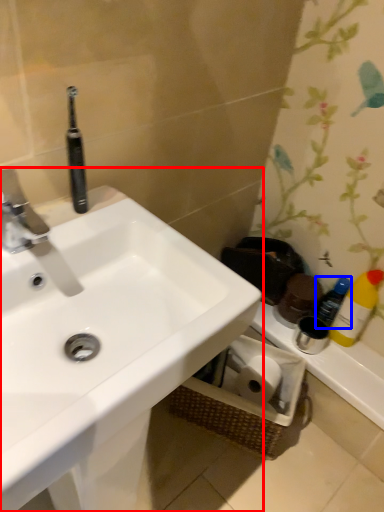
Question: Which object is further to the camera taking this photo, sink (highlighted by a red box) or bottle (highlighted by a blue box)?

Choices:
 (A) sink
 (B) bottle

Answer: (B)